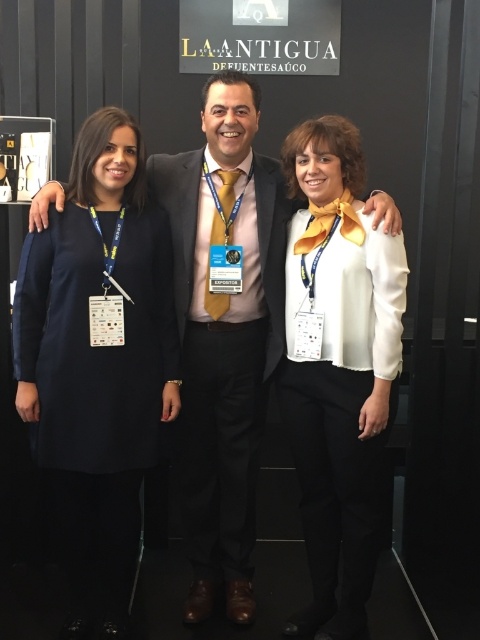
Question: Which point is farther to the camera?

Choices:
 (A) (254, 241)
 (B) (67, 506)
 (C) (205, 536)

Answer: (C)

Question: Can you confirm if matte black dress at left is smaller than white satin blouse at center?

Choices:
 (A) yes
 (B) no

Answer: (B)

Question: Which point is farther to the camera?

Choices:
 (A) (203, 582)
 (B) (59, 269)
 (C) (343, 282)
 (D) (219, 547)

Answer: (D)

Question: Can you confirm if matte black dress at left is positioned below white satin blouse at center?

Choices:
 (A) yes
 (B) no

Answer: (B)

Question: Does matte black dress at left have a lesser width compared to white satin blouse at center?

Choices:
 (A) yes
 (B) no

Answer: (B)

Question: Which of the following is the closest to the observer?

Choices:
 (A) (194, 273)
 (B) (109, 216)
 (C) (192, 163)
 (D) (345, 513)

Answer: (B)